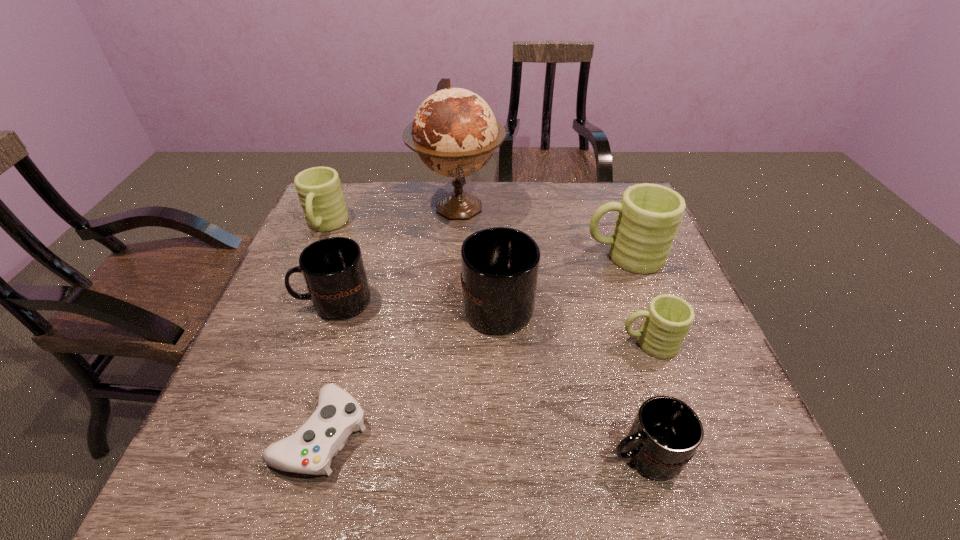
The image size is (960, 540). I want to click on unoccupied position between the nearest green mug and the tallest object, so click(x=553, y=275).

The height and width of the screenshot is (540, 960). Find the location of `vacant space in between the biggest black mug and the smallest green mug`. vacant space in between the biggest black mug and the smallest green mug is located at coordinates (573, 322).

Identify the location of vacant area that lies between the nearest mug and the shortest object. (483, 444).

The image size is (960, 540). What are the coordinates of `vacant region between the white control and the nearest green mug` in the screenshot? It's located at (485, 389).

Locate an element on the screen. The image size is (960, 540). free space between the smallest black mug and the tallest object is located at coordinates (551, 331).

Where is `vacant space in between the tallest object and the nearest black mug`? The height and width of the screenshot is (540, 960). vacant space in between the tallest object and the nearest black mug is located at coordinates (551, 331).

At what (x,y) coordinates should I click in order to perform the action: click on free spot between the white control and the leftmost green mug. Please return your answer as a coordinate pair (x, y). The width and height of the screenshot is (960, 540). Looking at the image, I should click on (324, 330).

Where is `object that is the fifth closest to the nearest green mug`? object that is the fifth closest to the nearest green mug is located at coordinates (310, 450).

In order to click on the fourth closest object to the biggest green mug in this screenshot , I will do `click(666, 432)`.

Image resolution: width=960 pixels, height=540 pixels. Identify the location of mug that is the second closest one to the smallest green mug. (649, 215).